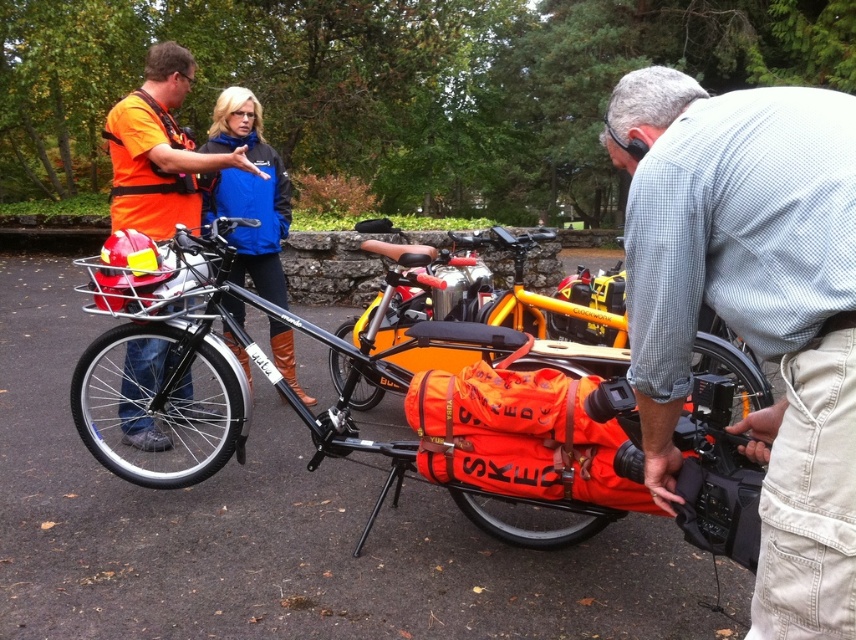
You are standing in the park and see the gray checkered shirt at center and the orange fabric bag at lower center. Which one is closer to you?

The gray checkered shirt at center is closer to you because it is in front of the orange fabric bag at lower center.

You are a delivery person who needs to reach the blue fabric jacket at upper center from the orange fabric cargo bike at center. Given that your delivery vehicle has a maximum range of 20 inches, can you reach it without moving the vehicle?

The distance between the orange fabric cargo bike at center and the blue fabric jacket at upper center is 21.38 inches, which exceeds the delivery vehicle maximum range of 20 inches. Therefore, you cannot reach the blue fabric jacket at upper center without moving the vehicle.